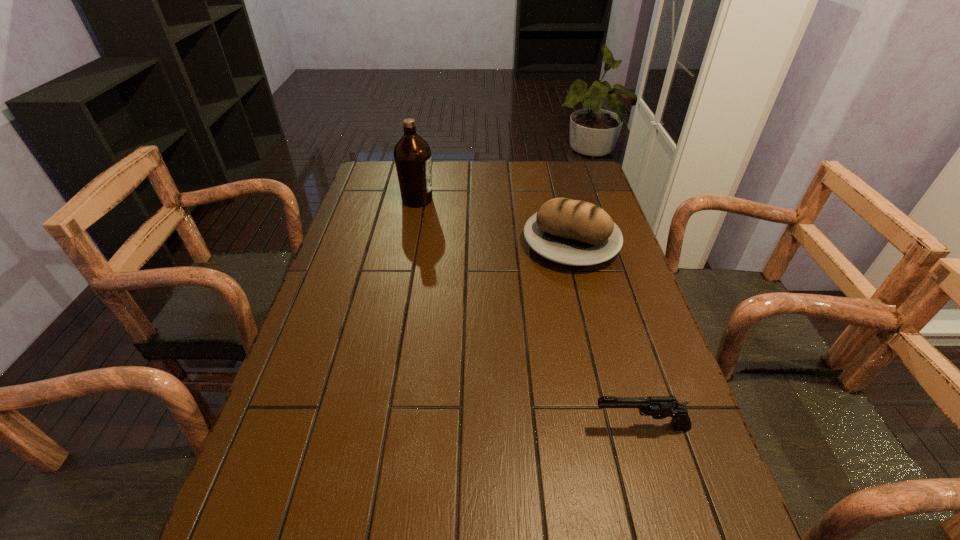
This screenshot has width=960, height=540. What are the coordinates of `object that is the second closest one to the second shortest object` in the screenshot? It's located at (659, 407).

The height and width of the screenshot is (540, 960). Find the location of `free spot that satisfies the following two spatial constraints: 1. on the label of the olive oil; 2. on the back side of the second nearest object`. free spot that satisfies the following two spatial constraints: 1. on the label of the olive oil; 2. on the back side of the second nearest object is located at coordinates (409, 244).

Find the location of `free space that satisfies the following two spatial constraints: 1. on the label of the bread; 2. on the left side of the tallest object`. free space that satisfies the following two spatial constraints: 1. on the label of the bread; 2. on the left side of the tallest object is located at coordinates (409, 244).

At what (x,y) coordinates should I click in order to perform the action: click on blank space that satisfies the following two spatial constraints: 1. on the back side of the second shortest object; 2. on the label of the olive oil. Please return your answer as a coordinate pair (x, y). The image size is (960, 540). Looking at the image, I should click on (560, 200).

Image resolution: width=960 pixels, height=540 pixels. Find the location of `free spot that satisfies the following two spatial constraints: 1. on the label of the second shortest object; 2. on the right side of the farthest object`. free spot that satisfies the following two spatial constraints: 1. on the label of the second shortest object; 2. on the right side of the farthest object is located at coordinates (409, 244).